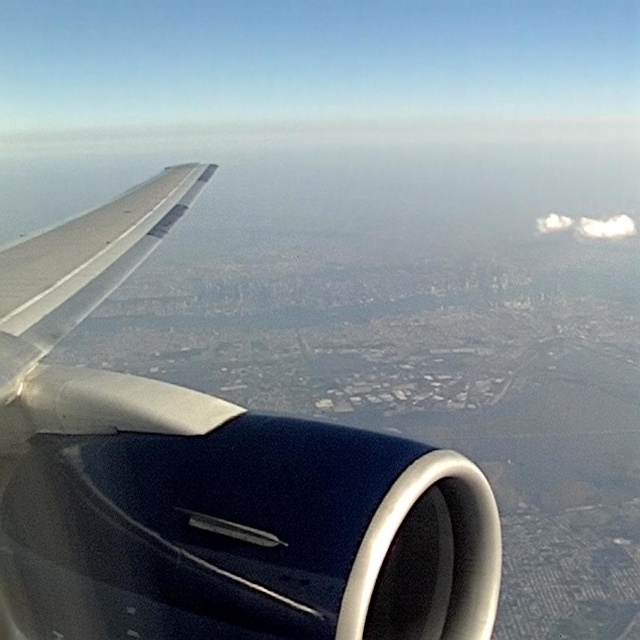
Is metallic blue engine at center further to camera compared to white fluffy cloud at upper right?

No, metallic blue engine at center is closer to the viewer.

Does point (58, 390) come farther from viewer compared to point (576, 227)?

No, (58, 390) is closer to viewer.

Find the location of a particular element. The width and height of the screenshot is (640, 640). metallic blue engine at center is located at coordinates (208, 483).